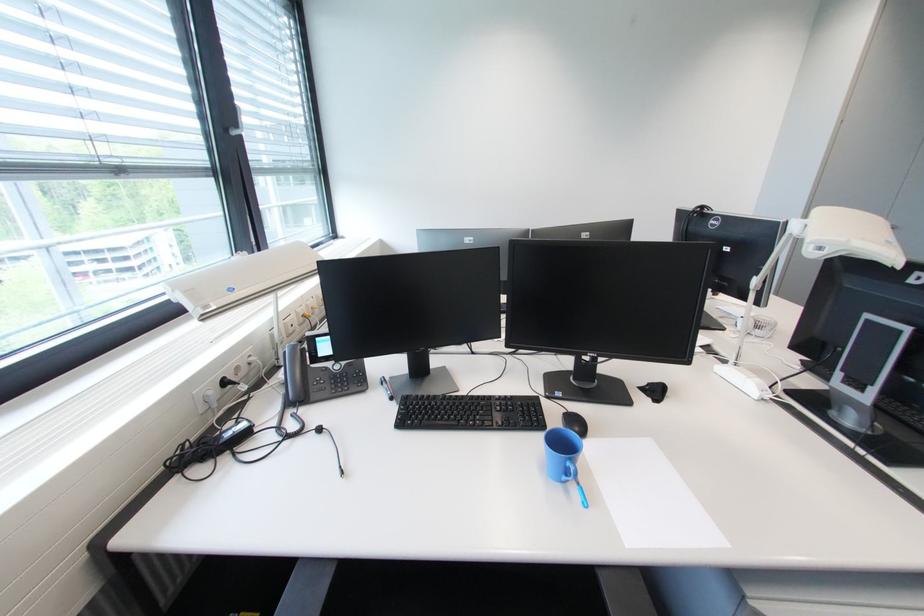
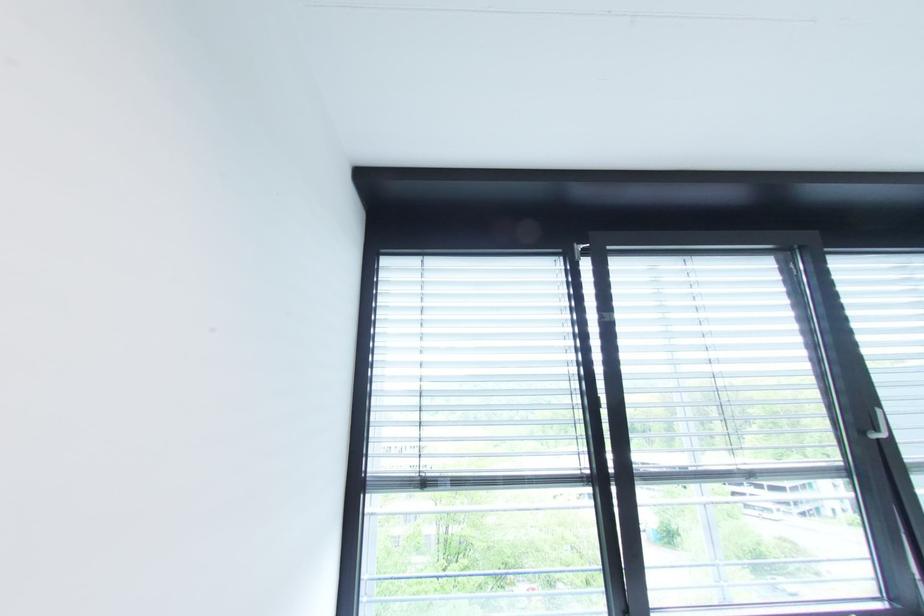
The images are taken continuously from a first-person perspective. In which direction is your viewpoint rotating?

The camera's rotation is toward left-up.